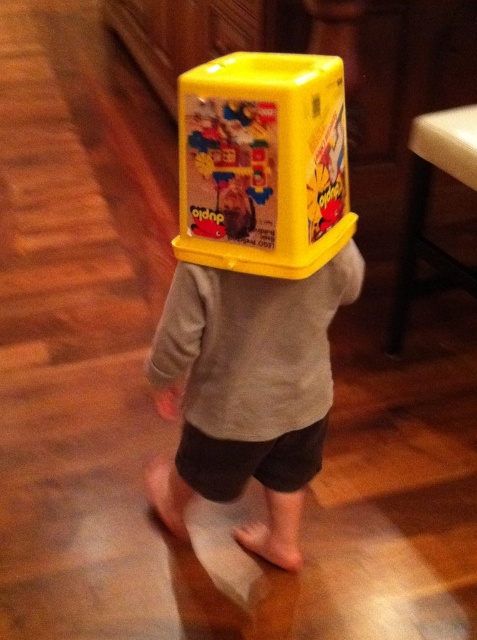
Can you confirm if yellow plastic toy at center is shorter than white plastic stool at lower right?

Correct, yellow plastic toy at center is not as tall as white plastic stool at lower right.

Measure the distance from yellow plastic toy at center to white plastic stool at lower right.

yellow plastic toy at center and white plastic stool at lower right are 70.76 centimeters apart.

Where is `yellow plastic toy at center`? The height and width of the screenshot is (640, 477). yellow plastic toy at center is located at coordinates (262, 163).

Does point (294, 314) lie in front of point (465, 120)?

Yes, it is in front of point (465, 120).

The image size is (477, 640). In order to click on yellow plastic container at back in this screenshot , I will do `click(248, 390)`.

Is point (294, 388) positioned before point (446, 148)?

Yes, point (294, 388) is in front of point (446, 148).

Locate an element on the screen. This screenshot has width=477, height=640. yellow plastic container at back is located at coordinates (248, 390).

Does yellow plastic container at back have a larger size compared to yellow plastic toy at center?

Correct, yellow plastic container at back is larger in size than yellow plastic toy at center.

Measure the distance between yellow plastic container at back and camera.

yellow plastic container at back and camera are 33.31 inches apart.

I want to click on yellow plastic container at back, so click(248, 390).